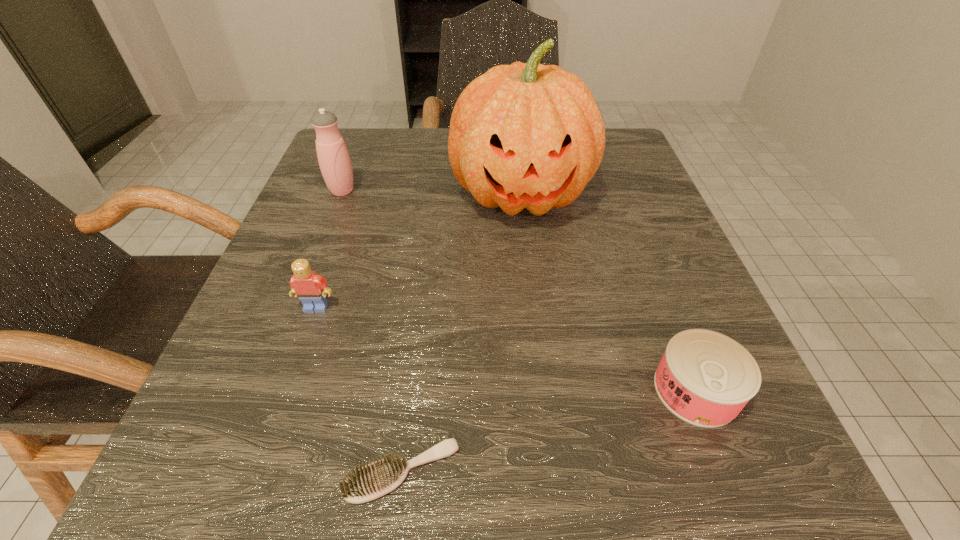
Where is `vacant area in the image that satisfies the following two spatial constraints: 1. on the front-facing side of the nearest object; 2. on the left side of the third nearest object`? The image size is (960, 540). vacant area in the image that satisfies the following two spatial constraints: 1. on the front-facing side of the nearest object; 2. on the left side of the third nearest object is located at coordinates (259, 471).